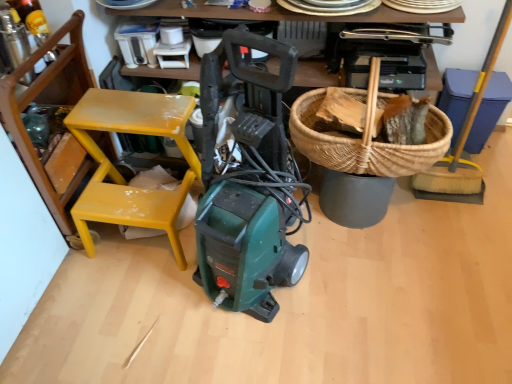
Question: In terms of width, does yellow-bristled broom at right look wider or thinner when compared to yellow painted wood chair at left?

Choices:
 (A) wide
 (B) thin

Answer: (B)

Question: From the image's perspective, is yellow-bristled broom at right positioned above or below yellow painted wood chair at left?

Choices:
 (A) above
 (B) below

Answer: (A)

Question: Which object is positioned closest to the yellow-bristled broom at right?

Choices:
 (A) woven brown basket at upper right
 (B) yellow painted wood chair at left

Answer: (A)

Question: Considering the real-world distances, which object is farthest from the yellow-bristled broom at right?

Choices:
 (A) yellow painted wood chair at left
 (B) woven brown basket at upper right

Answer: (A)